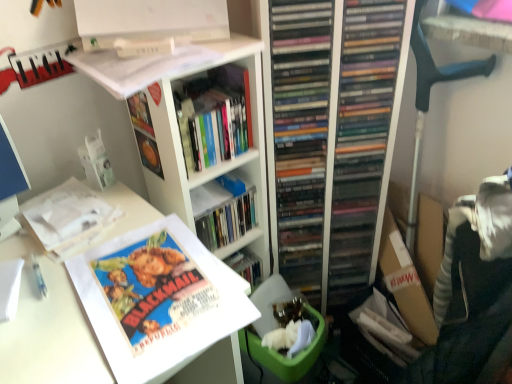
You are a GUI agent. You are given a task and a screenshot of the screen. Output one action in this format:
    pyautogui.click(x=<x>, y=<y>)
    Task: Click on the free location in front of white paper at upper left, acting as the 2th book starting from the top
    Image resolution: width=512 pixels, height=384 pixels.
    Given the screenshot: What is the action you would take?
    pyautogui.click(x=49, y=280)